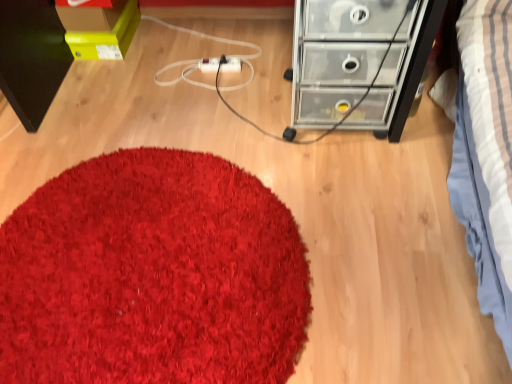
The height and width of the screenshot is (384, 512). Find the location of `free point to the right of shaggy red carpet at center`. free point to the right of shaggy red carpet at center is located at coordinates (375, 240).